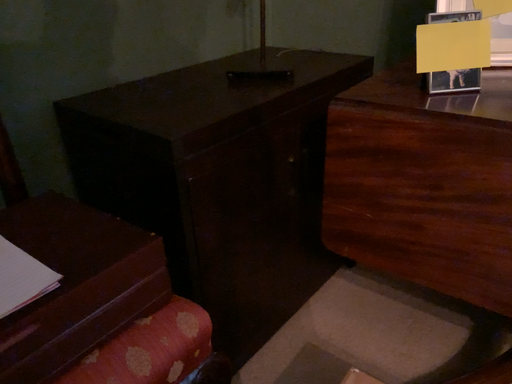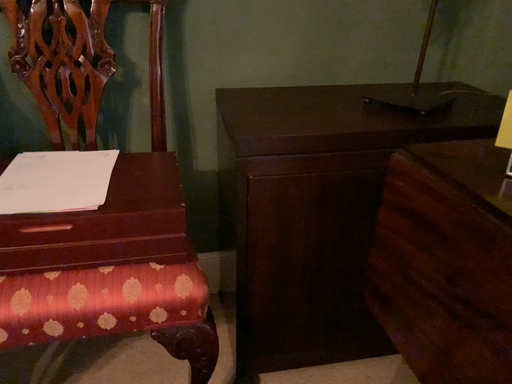
Question: How did the camera likely rotate when shooting the video?

Choices:
 (A) rotated right
 (B) rotated left

Answer: (B)